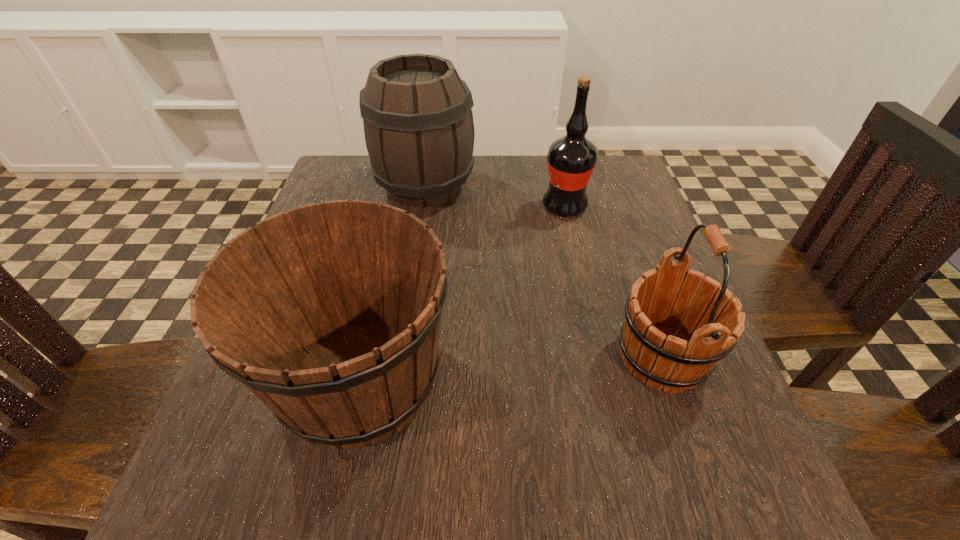
Locate an element on the screen. This screenshot has height=540, width=960. wine bucket that is at the right edge is located at coordinates (676, 330).

The height and width of the screenshot is (540, 960). In order to click on object positioned at the far left corner in this screenshot , I will do `click(417, 114)`.

The height and width of the screenshot is (540, 960). What are the coordinates of `object present at the near left corner` in the screenshot? It's located at (330, 314).

Where is `object positioned at the far right corner`? object positioned at the far right corner is located at coordinates [x=571, y=159].

The width and height of the screenshot is (960, 540). Identify the location of free space at the far edge of the desktop. (445, 207).

Image resolution: width=960 pixels, height=540 pixels. I want to click on vacant space at the near edge of the desktop, so click(x=477, y=481).

Identify the location of vacant area at the right edge of the desktop. Image resolution: width=960 pixels, height=540 pixels. (618, 268).

Where is `vacant space at the far left corner`? vacant space at the far left corner is located at coordinates (342, 198).

Find the location of a particular element. vacant space at the near left corner is located at coordinates (232, 492).

I want to click on free spot at the far right corner of the desktop, so pos(612,158).